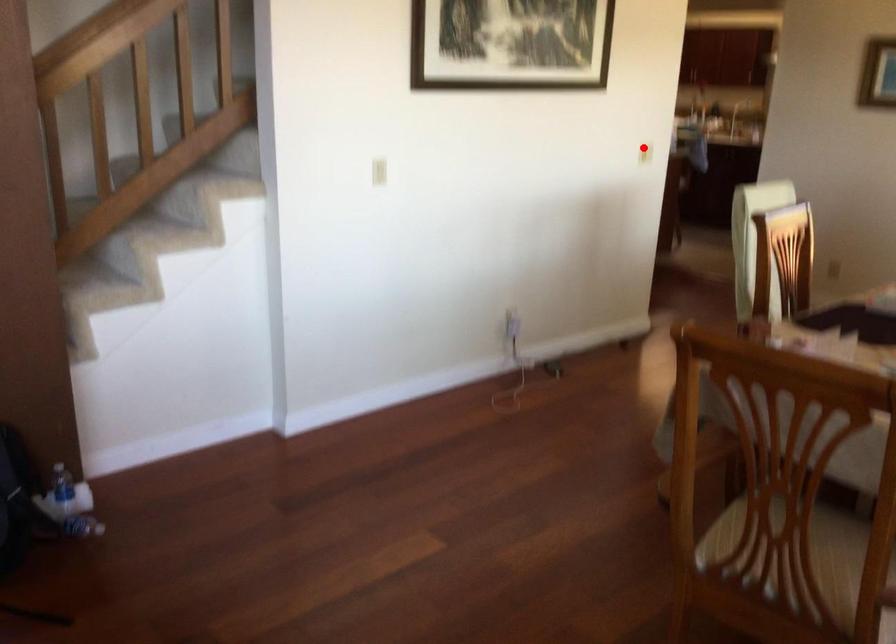
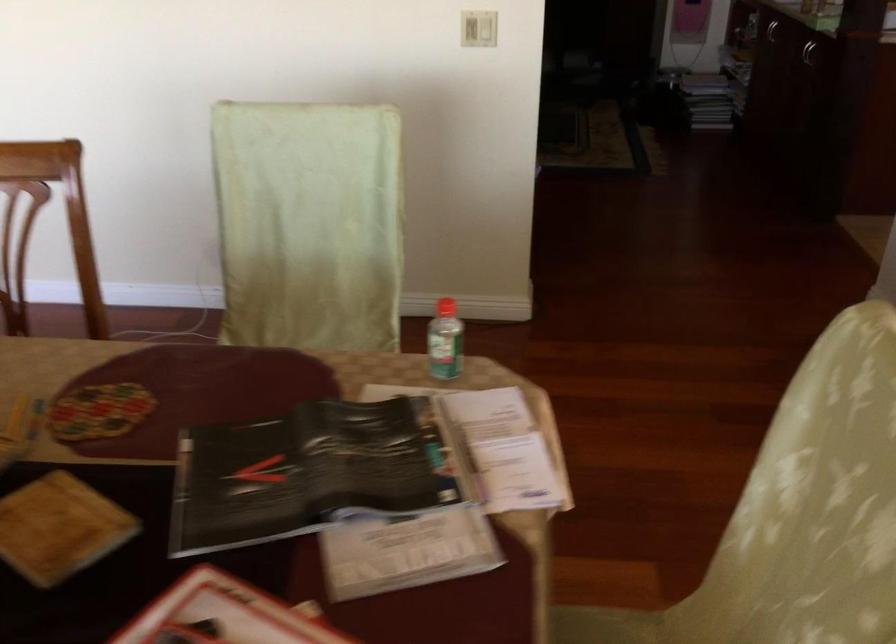
Question: I am providing you with two images of the same scene from different viewpoints. Given a red point in image1, look at the same physical point in image2. Is it:

Choices:
 (A) Closer to the viewpoint
 (B) Farther from the viewpoint

Answer: (A)